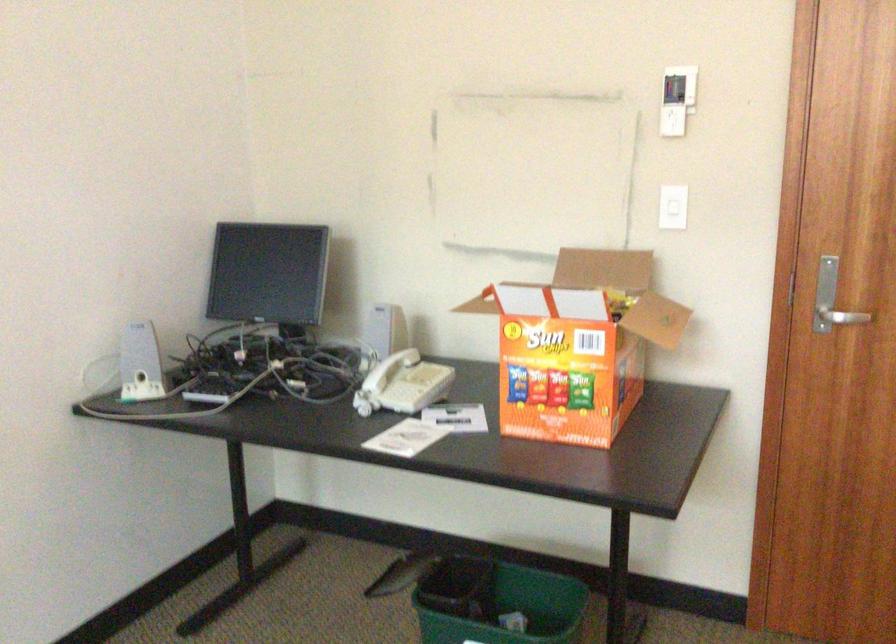
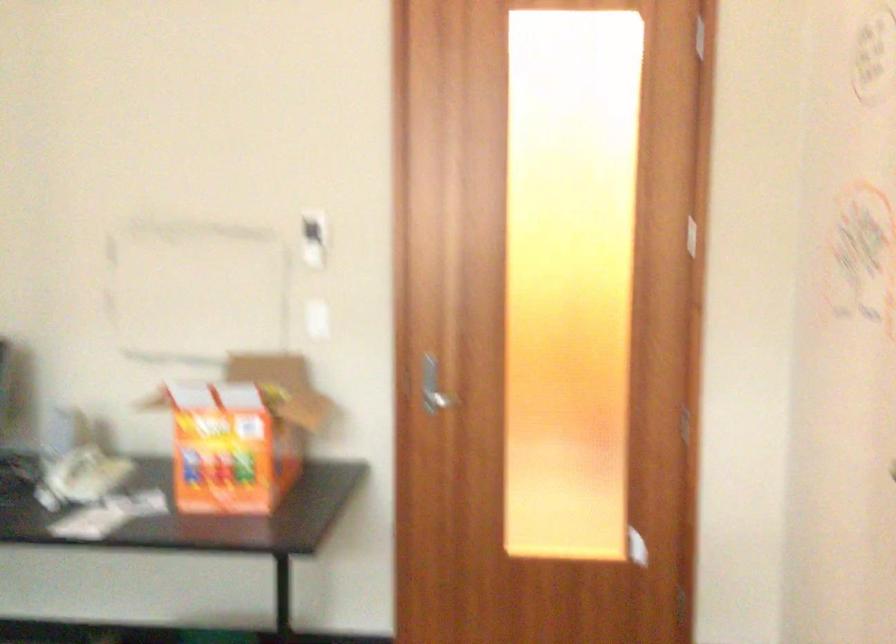
Question: Based on the continuous images, in which direction is the camera rotating? Reply with the corresponding letter.

Choices:
 (A) Left
 (B) Right
 (C) Up
 (D) Down

Answer: (B)